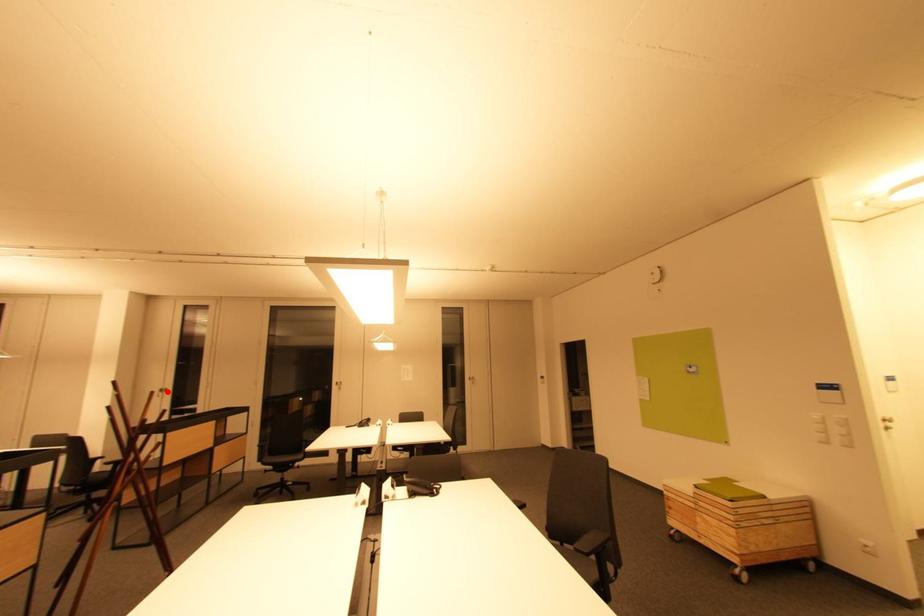
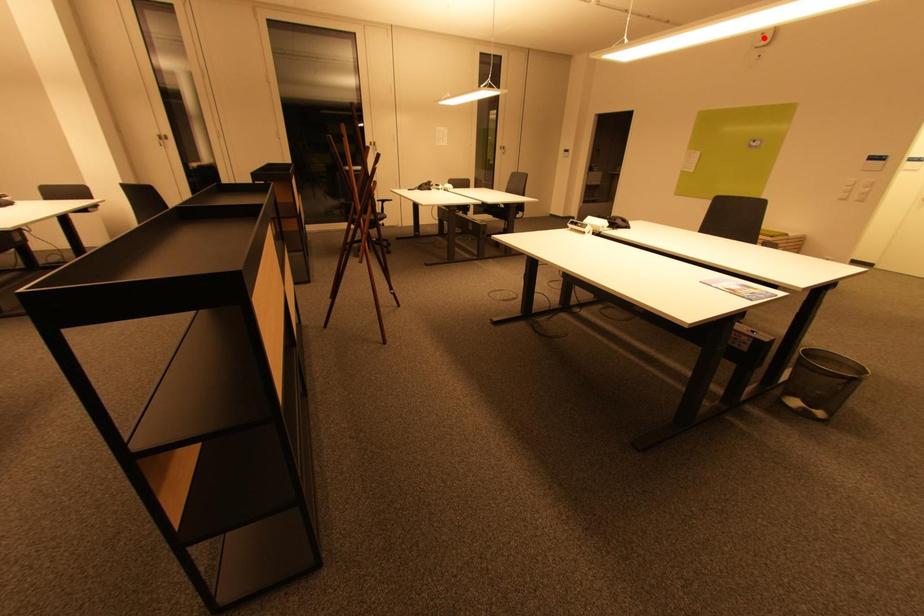
I am providing you with two images of the same scene from different viewpoints. A red point is marked on the first image and another point is marked on the second image. Is the red point in image1 aligned with the point shown in image2?

No